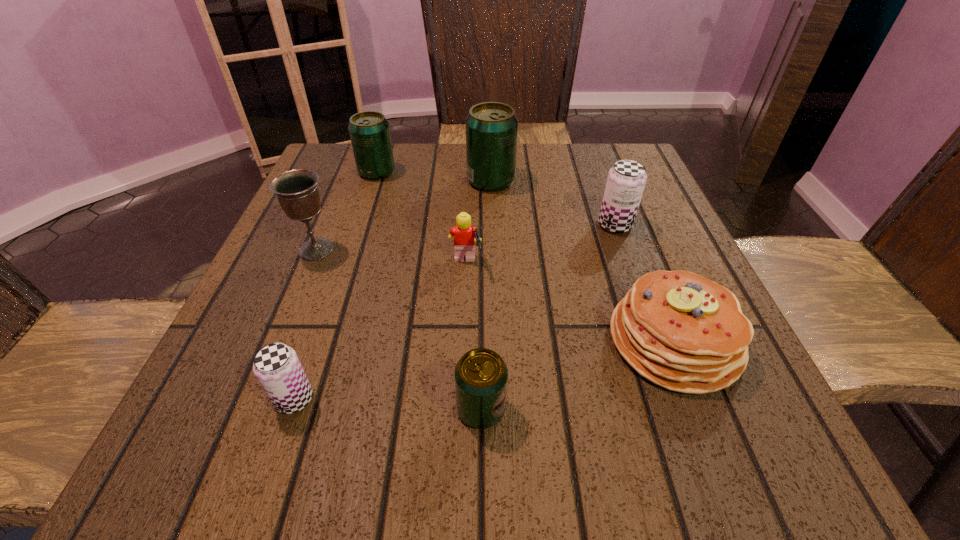
At what (x,y) coordinates should I click in order to perform the action: click on pancake that is positioned at the right edge. Please return your answer as a coordinate pair (x, y). Looking at the image, I should click on (681, 331).

Locate an element on the screen. This screenshot has height=540, width=960. object that is at the far left corner is located at coordinates (369, 131).

Where is `object positioned at the near left corner`? The image size is (960, 540). object positioned at the near left corner is located at coordinates (277, 367).

Where is `vacant space at the far edge of the desktop`? Image resolution: width=960 pixels, height=540 pixels. vacant space at the far edge of the desktop is located at coordinates (540, 158).

In the image, there is a desktop. At what (x,y) coordinates should I click in order to perform the action: click on vacant space at the near edge. Please return your answer as a coordinate pair (x, y). Looking at the image, I should click on (397, 421).

Find the location of `vacant region at the right edge of the desktop`. vacant region at the right edge of the desktop is located at coordinates (661, 247).

Image resolution: width=960 pixels, height=540 pixels. I want to click on vacant region at the far left corner of the desktop, so click(335, 163).

Find the location of a particular element. Image resolution: width=960 pixels, height=540 pixels. vacant space at the far right corner of the desktop is located at coordinates (647, 191).

Where is `vacant space at the near right corner of the desktop`? vacant space at the near right corner of the desktop is located at coordinates (687, 453).

This screenshot has width=960, height=540. What are the coordinates of `unoccupied area between the third nearest beer can and the tallest beer can` in the screenshot? It's located at (553, 203).